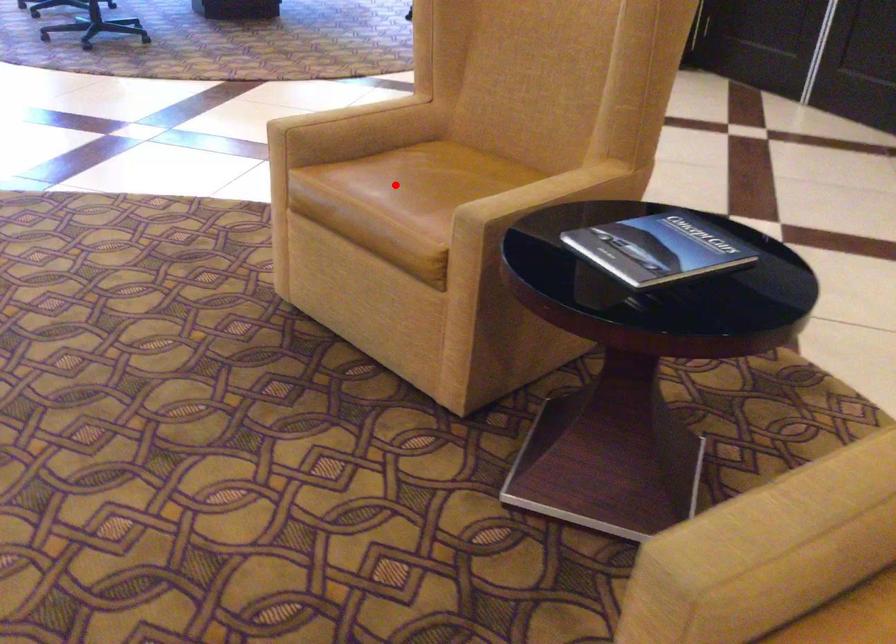
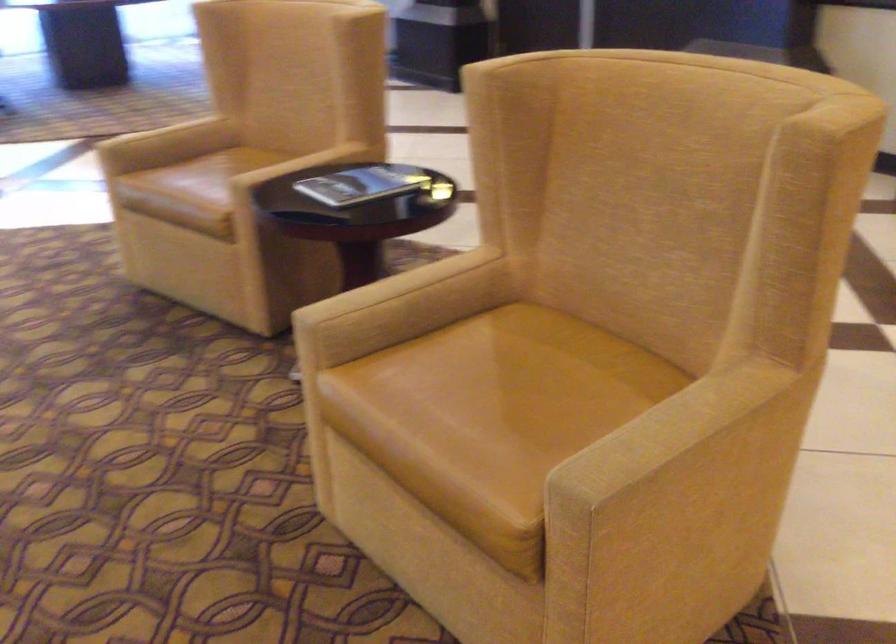
Find the pixel in the second image that matches the highlighted location in the first image.

(199, 176)